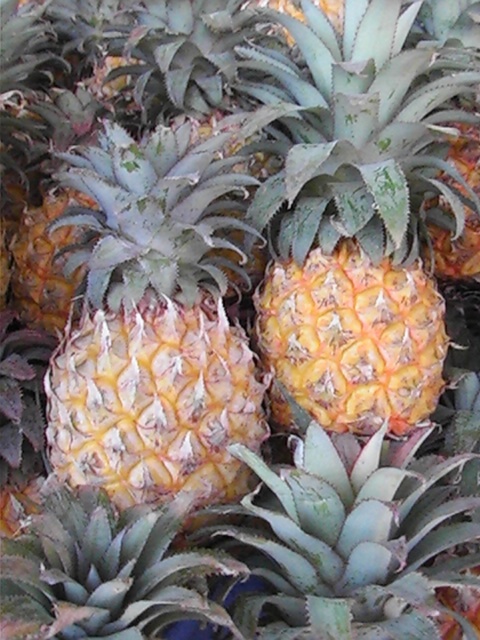
You are arranging pineapples on a display shelf and need to place the yellow matte pineapple at center and the yellow textured pineapple at center in a specific order. According to their positions in the image, which pineapple should be placed to the left when arranging them side by side?

The yellow textured pineapple at center should be placed to the left because the yellow matte pineapple at center is positioned to its right in the image.

You are a fruit vendor arranging pineapples on a display. You have a yellow matte pineapple at center and a yellow textured pineapple at center. Which pineapple should you place closer to the front of the display to make it more visible?

You should place the yellow matte pineapple at center closer to the front of the display because it is further to the viewer than the yellow textured pineapple at center, making it naturally more visible from the front.

In the scene shown: You are a fruit seller arranging pineapples on a shelf. You have two pineapples in front of you, the yellow matte pineapple at center and the yellow textured pineapple at center. Which one should you choose if you want to display the taller pineapple?

The yellow matte pineapple at center is much taller than the yellow textured pineapple at center, so you should choose the yellow matte pineapple at center for display.